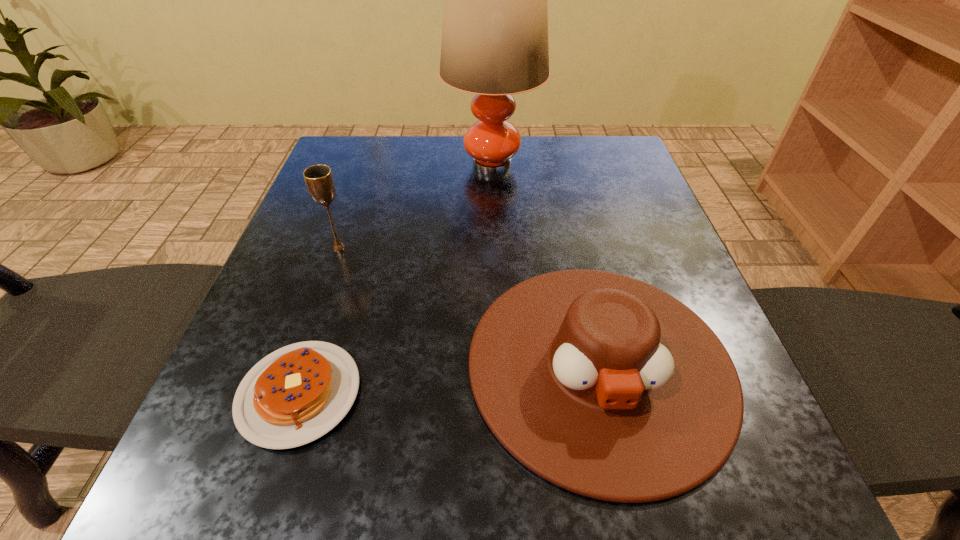
Find the location of a particular element. This screenshot has height=540, width=960. blank area at the near left corner is located at coordinates (252, 488).

Locate an element on the screen. Image resolution: width=960 pixels, height=540 pixels. free space at the far right corner is located at coordinates (597, 156).

Identify the location of free space between the shortest object and the chalice. Image resolution: width=960 pixels, height=540 pixels. (319, 321).

Where is `vacant space in between the third tallest object and the chalice`? The height and width of the screenshot is (540, 960). vacant space in between the third tallest object and the chalice is located at coordinates (469, 306).

Identify the location of vacant space in between the shortest object and the lamp. This screenshot has height=540, width=960. (396, 279).

This screenshot has height=540, width=960. I want to click on unoccupied area between the third tallest object and the pancake, so click(x=449, y=379).

This screenshot has height=540, width=960. What are the coordinates of `empty space between the third shortest object and the second shortest object` in the screenshot? It's located at (469, 306).

Find the location of a particular element. The image size is (960, 540). free spot between the farthest object and the third nearest object is located at coordinates (416, 206).

This screenshot has height=540, width=960. Identify the location of blank region between the third nearest object and the pancake. (x=319, y=321).

I want to click on free space between the shortest object and the second farthest object, so click(x=319, y=321).